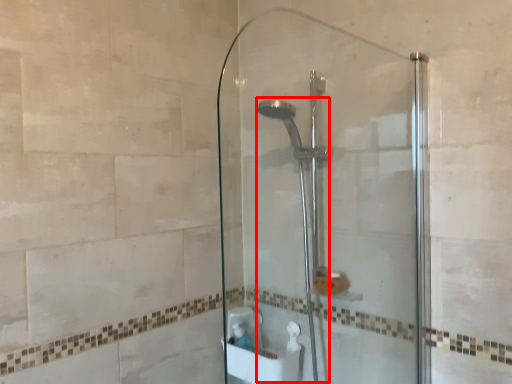
Question: From the image's perspective, what is the correct spatial relationship of shower (annotated by the red box) in relation to screen door?

Choices:
 (A) above
 (B) below

Answer: (B)